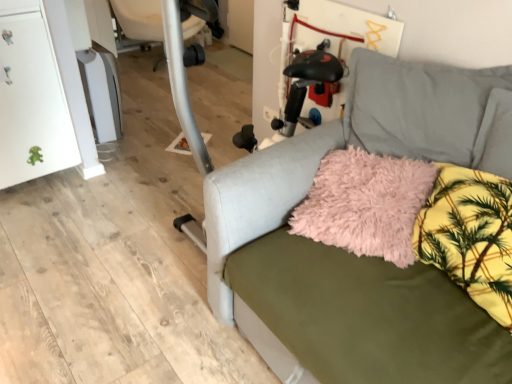
Question: From the image's perspective, is white plastic swivel chair at upper left above or below yellow floral fabric pillow at lower right?

Choices:
 (A) below
 (B) above

Answer: (B)

Question: Considering the positions of white plastic swivel chair at upper left and yellow floral fabric pillow at lower right in the image, is white plastic swivel chair at upper left bigger or smaller than yellow floral fabric pillow at lower right?

Choices:
 (A) small
 (B) big

Answer: (B)

Question: Which of these objects is positioned farthest from the white plastic swivel chair at upper left?

Choices:
 (A) matte gray couch at center
 (B) fluffy pink pillow at center
 (C) yellow floral fabric pillow at lower right

Answer: (C)

Question: Estimate the real-world distances between objects in this image. Which object is closer to the white plastic swivel chair at upper left?

Choices:
 (A) matte gray couch at center
 (B) fluffy pink pillow at center
 (C) yellow floral fabric pillow at lower right

Answer: (A)